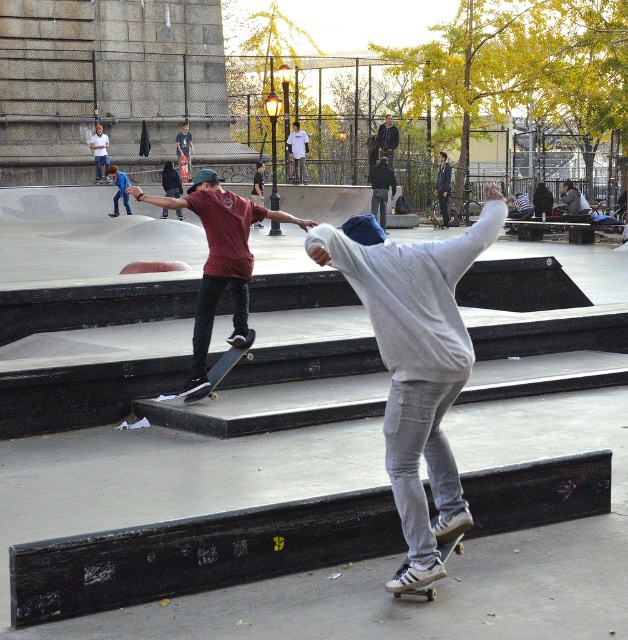
Question: Is gray cotton hoodie at center thinner than dark green jacket at center?

Choices:
 (A) yes
 (B) no

Answer: (B)

Question: Which object is the farthest from the matte black skateboard at center?

Choices:
 (A) matte red shirt at center
 (B) gray hoodie at center
 (C) dark green jacket at center
 (D) white cotton t-shirt at center

Answer: (A)

Question: Considering the real-world distances, which object is closest to the matte red shirt at center?

Choices:
 (A) matte black skateboard at center
 (B) dark gray hoodie at center
 (C) black matte skateboard at center
 (D) gray cotton hoodie at center

Answer: (C)

Question: Is dark green jacket at center wider than dark gray hoodie at center?

Choices:
 (A) yes
 (B) no

Answer: (A)

Question: From the image, what is the correct spatial relationship of gray cotton hoodie at center in relation to white cotton t-shirt at center?

Choices:
 (A) left
 (B) right

Answer: (B)

Question: Among these objects, which one is nearest to the camera?

Choices:
 (A) black matte skateboard at center
 (B) white cotton t-shirt at center
 (C) matte black skateboard at center
 (D) gray hoodie at center

Answer: (A)